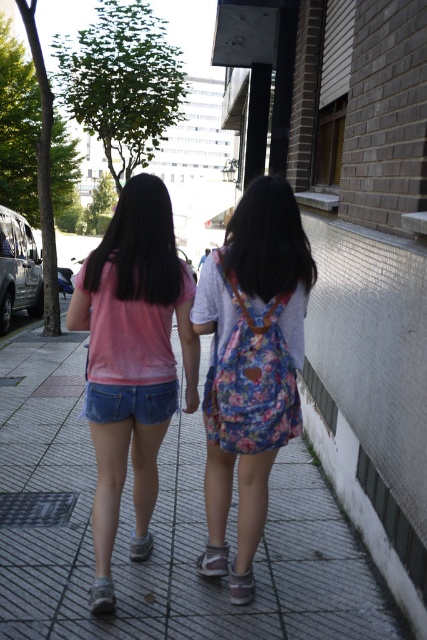
Which is more to the right, gray concrete pavement at center or brown suede sandal at lower center?

Positioned to the right is brown suede sandal at lower center.

Measure the distance from gray concrete pavement at center to brown suede sandal at lower center.

They are 6.75 inches apart.

Who is more distant from viewer, (283, 636) or (237, 586)?

The point (237, 586) is more distant.

Image resolution: width=427 pixels, height=640 pixels. I want to click on gray concrete pavement at center, so click(x=161, y=531).

Which is in front, point (96, 392) or point (207, 576)?

Point (96, 392) is in front.

Does point (98, 401) lie behind point (210, 572)?

That is False.

Identify the location of denim shorts at center. The height and width of the screenshot is (640, 427). (129, 403).

Who is more distant from viewer, (157, 420) or (231, 561)?

The point (231, 561) is more distant.

Where is `denim shorts at center`? The image size is (427, 640). denim shorts at center is located at coordinates (129, 403).

You are a GUI agent. You are given a task and a screenshot of the screen. Output one action in this format:
    pyautogui.click(x=<x>, y=<y>)
    Task: Click on the denim shorts at center
    Image resolution: width=427 pixels, height=640 pixels.
    Given the screenshot: What is the action you would take?
    [x=129, y=403]